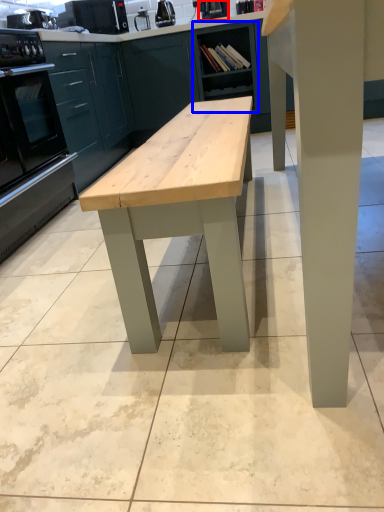
Question: Among these objects, which one is nearest to the camera, appliance (highlighted by a red box) or cabinetry (highlighted by a blue box)?

Choices:
 (A) appliance
 (B) cabinetry

Answer: (B)